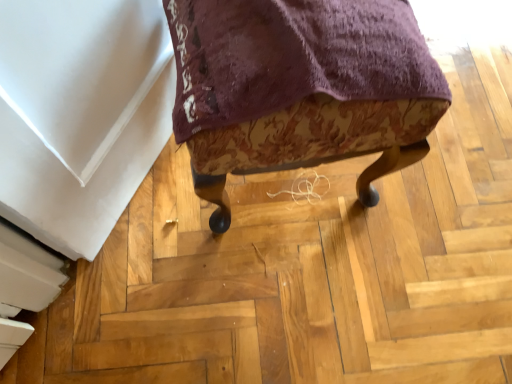
The width and height of the screenshot is (512, 384). What do you see at coordinates (300, 88) in the screenshot?
I see `velvet floral ottoman at center` at bounding box center [300, 88].

Looking at this image, measure the distance between point (194,100) and camera.

The depth of point (194,100) is 21.10 inches.

This screenshot has width=512, height=384. I want to click on velvet floral ottoman at center, so click(300, 88).

In order to face velvet floral ottoman at center, should I rotate leftwards or rightwards?

You should rotate right by 3.952 degrees.

Identify the location of velvet floral ottoman at center. The width and height of the screenshot is (512, 384). (300, 88).